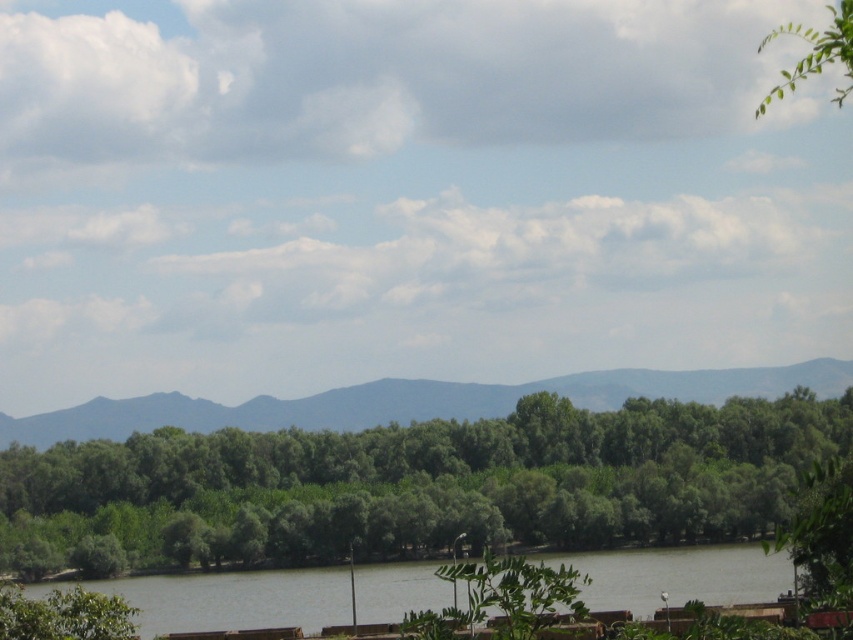
Question: Can you confirm if green leafy river at center is wider than green leafy tree at upper right?

Choices:
 (A) yes
 (B) no

Answer: (B)

Question: Is green leafy trees at center smaller than gray/distant mountain at center?

Choices:
 (A) no
 (B) yes

Answer: (A)

Question: Is green leafy trees at center positioned at the back of green leafy river at center?

Choices:
 (A) no
 (B) yes

Answer: (B)

Question: Which of the following is the closest to the observer?

Choices:
 (A) green leafy river at center
 (B) gray/distant mountain at center
 (C) green leafy trees at center
 (D) green leafy tree at upper right

Answer: (A)

Question: Which point is closer to the camera?

Choices:
 (A) 631,397
 (B) 701,397
 (C) 798,81

Answer: (C)

Question: Which of these objects is positioned closest to the green leafy river at center?

Choices:
 (A) green leafy tree at upper right
 (B) green leafy trees at center

Answer: (B)